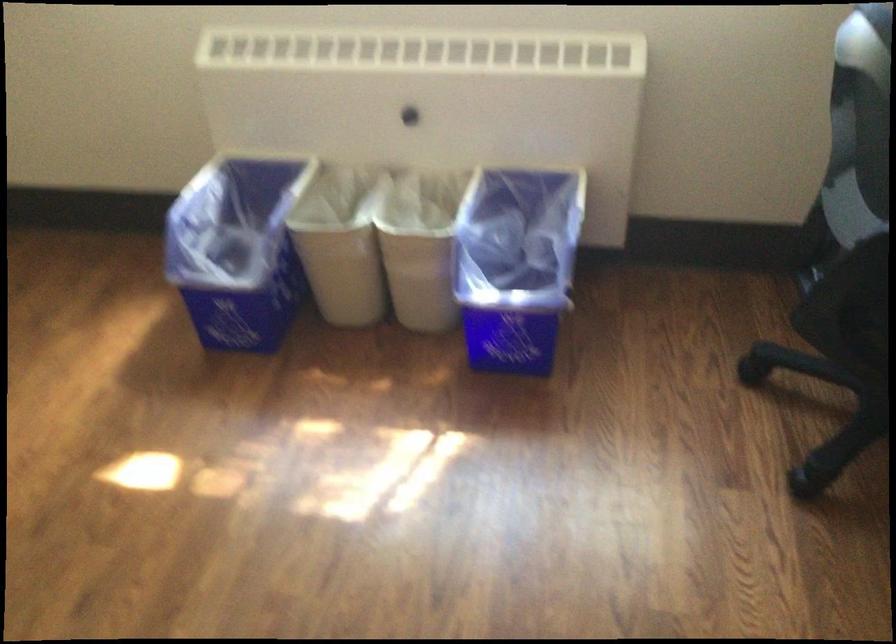
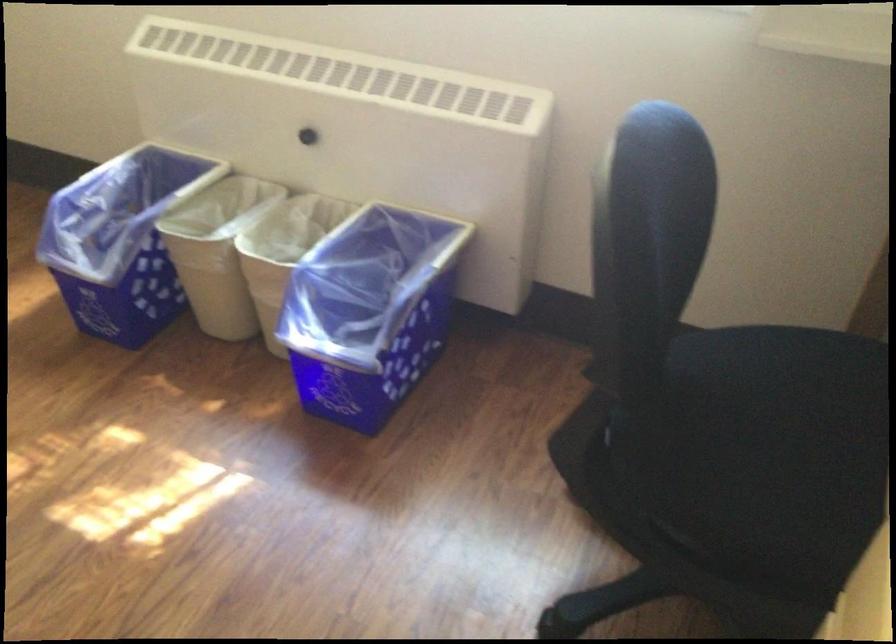
Question: Based on the continuous images, in which direction is the camera rotating? Reply with the corresponding letter.

Choices:
 (A) Left
 (B) Right
 (C) Up
 (D) Down

Answer: (A)